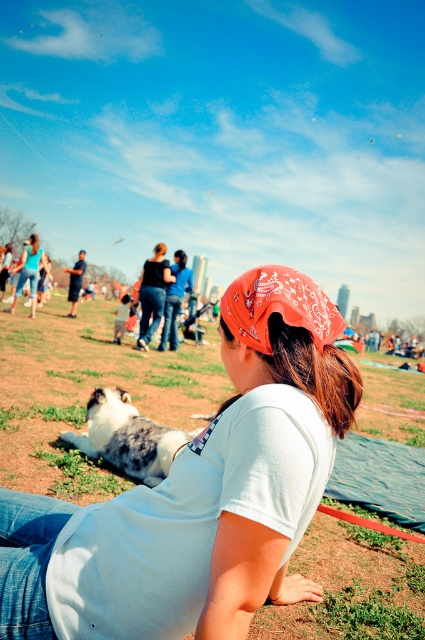
Question: Among these objects, which one is nearest to the camera?

Choices:
 (A) white cotton shirt at center
 (B) brown silky hair at center
 (C) red bandana at center
 (D) fluffy gray cat at lower left

Answer: (A)

Question: Among these points, which one is farthest from the camera?

Choices:
 (A) (249, 296)
 (B) (146, 451)
 (C) (278, 346)

Answer: (B)

Question: Can you confirm if red bandana at center is smaller than brown silky hair at center?

Choices:
 (A) yes
 (B) no

Answer: (A)

Question: Which point is farther to the camera?

Choices:
 (A) (8, 534)
 (B) (343, 428)
 (C) (127, 412)
 (D) (305, 314)

Answer: (C)

Question: Does white cotton shirt at center have a smaller size compared to fluffy gray cat at lower left?

Choices:
 (A) yes
 (B) no

Answer: (B)

Question: Is white cotton shirt at center further to the viewer compared to brown silky hair at center?

Choices:
 (A) yes
 (B) no

Answer: (B)